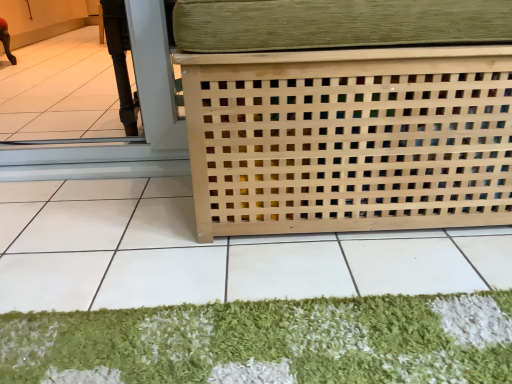
Image resolution: width=512 pixels, height=384 pixels. Describe the element at coordinates (210, 253) in the screenshot. I see `natural wood lattice at center` at that location.

Where is `natural wood lattice at center`? The height and width of the screenshot is (384, 512). natural wood lattice at center is located at coordinates (347, 114).

Is green shaggy mat at lower center facing towards natural wood lattice at center?

Yes, green shaggy mat at lower center is facing natural wood lattice at center.

Consider the image. From the image's perspective, which object appears higher, green shaggy mat at lower center or natural wood lattice at center?

natural wood lattice at center.

Which is correct: green shaggy mat at lower center is inside natural wood lattice at center, or outside of it?

green shaggy mat at lower center is inside natural wood lattice at center.

Between green shaggy mat at lower center and natural wood lattice at center, which one has larger size?

Bigger between the two is natural wood lattice at center.

How different are the orientations of natural wood lattice at center and natural wood lattice at center in degrees?

180 degrees separate the facing orientations of natural wood lattice at center and natural wood lattice at center.

Is natural wood lattice at center spatially inside natural wood lattice at center, or outside of it?

natural wood lattice at center is outside natural wood lattice at center.

Who is bigger, natural wood lattice at center or natural wood lattice at center?

natural wood lattice at center.

From a real-world perspective, which is physically below, natural wood lattice at center or natural wood lattice at center?

natural wood lattice at center, from a real-world perspective.

Is natural wood lattice at center thinner than natural wood lattice at center?

Correct, the width of natural wood lattice at center is less than that of natural wood lattice at center.

Does natural wood lattice at center come behind natural wood lattice at center?

Yes.

Is natural wood lattice at center bigger than natural wood lattice at center?

Indeed, natural wood lattice at center has a larger size compared to natural wood lattice at center.

Which is more to the right, natural wood lattice at center or natural wood lattice at center?

natural wood lattice at center is more to the right.

Find the location of a particular element. This screenshot has width=512, height=384. furniture behind the green shaggy mat at lower center is located at coordinates (347, 114).

Is green shaggy mat at lower center positioned with its back to natural wood lattice at center?

green shaggy mat at lower center does not have its back to natural wood lattice at center.

From a real-world perspective, which object stands above the other?

From a 3D spatial view, natural wood lattice at center is above.

In the scene shown: Which is nearer, [436,300] or [304,96]?

The point [436,300] is closer.

Locate an element on the screen. Image resolution: width=512 pixels, height=384 pixels. tile that appears in front of the green shaggy mat at lower center is located at coordinates (210, 253).

Is point (306, 248) positioned in front of point (31, 333)?

No, it is behind (31, 333).

From a real-world perspective, which object rests below the other?

natural wood lattice at center is physically lower.

In the image, is natural wood lattice at center positioned in front of or behind green shaggy mat at lower center?

natural wood lattice at center is positioned closer to the viewer than green shaggy mat at lower center.

In the scene shown: Is natural wood lattice at center in front of green shaggy mat at lower center?

No, natural wood lattice at center is further to the viewer.

Does point (303, 131) appear closer or farther from the camera than point (442, 346)?

Point (303, 131) is positioned farther from the camera compared to point (442, 346).

Considering the positions of objects natural wood lattice at center and green shaggy mat at lower center in the image provided, who is more to the left, natural wood lattice at center or green shaggy mat at lower center?

From the viewer's perspective, green shaggy mat at lower center appears more on the left side.

Locate an element on the screen. This screenshot has height=384, width=512. mat that is below the natural wood lattice at center (from the image's perspective) is located at coordinates (268, 342).

Image resolution: width=512 pixels, height=384 pixels. Find the location of `furniture above the natural wood lattice at center (from the image's perspective)`. furniture above the natural wood lattice at center (from the image's perspective) is located at coordinates (347, 114).

Based on their spatial positions, is natural wood lattice at center or natural wood lattice at center further from green shaggy mat at lower center?

The object further to green shaggy mat at lower center is natural wood lattice at center.

Based on their spatial positions, is green shaggy mat at lower center or natural wood lattice at center closer to natural wood lattice at center?

Based on the image, natural wood lattice at center appears to be nearer to natural wood lattice at center.

Considering their positions, is natural wood lattice at center positioned further to green shaggy mat at lower center than natural wood lattice at center?

natural wood lattice at center lies further to green shaggy mat at lower center than the other object.

When comparing their distances from natural wood lattice at center, does natural wood lattice at center or green shaggy mat at lower center seem further?

natural wood lattice at center is further to natural wood lattice at center.

When comparing their distances from natural wood lattice at center, does green shaggy mat at lower center or natural wood lattice at center seem further?

Based on the image, natural wood lattice at center appears to be further to natural wood lattice at center.

When comparing their distances from natural wood lattice at center, does natural wood lattice at center or green shaggy mat at lower center seem closer?

natural wood lattice at center is positioned closer to the anchor natural wood lattice at center.

Locate an element on the screen. tile between natural wood lattice at center and green shaggy mat at lower center in the up-down direction is located at coordinates (210, 253).